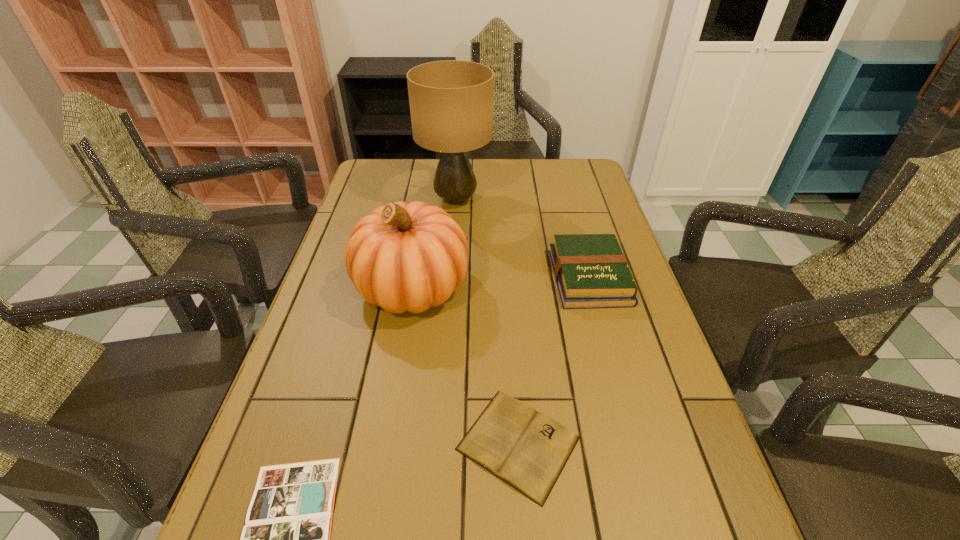
Locate an element on the screen. Image resolution: width=960 pixels, height=540 pixels. vacant area that lies between the tallest object and the second book from right to left is located at coordinates (487, 321).

You are a GUI agent. You are given a task and a screenshot of the screen. Output one action in this format:
    pyautogui.click(x=<x>, y=<y>)
    Task: Click on the vacant point located between the pumpkin and the second book from left to right
    This screenshot has width=960, height=540.
    Given the screenshot: What is the action you would take?
    pyautogui.click(x=466, y=365)

The width and height of the screenshot is (960, 540). What are the coordinates of `vacant space that is in between the fourth shortest object and the tallest book` in the screenshot? It's located at (501, 282).

Locate an element on the screen. This screenshot has height=540, width=960. free space between the rightmost book and the tallest object is located at coordinates (522, 239).

What are the coordinates of `free space between the second tallest object and the fourth tallest object` in the screenshot? It's located at (466, 365).

This screenshot has height=540, width=960. In order to click on free area in between the pumpkin and the third shortest object in this screenshot , I will do `click(501, 282)`.

You are a GUI agent. You are given a task and a screenshot of the screen. Output one action in this format:
    pyautogui.click(x=<x>, y=<y>)
    Task: Click on the object that is the second nearest to the pumpkin
    The height and width of the screenshot is (540, 960).
    Given the screenshot: What is the action you would take?
    pyautogui.click(x=528, y=450)

In order to click on object that can be found as the fourth closest to the farthest object in this screenshot , I will do `click(286, 539)`.

At what (x,y) coordinates should I click in order to perform the action: click on the second closest book to the second tallest object. Please return your answer as a coordinate pair (x, y). The height and width of the screenshot is (540, 960). Looking at the image, I should click on (591, 271).

Identify which book is the nearest to the pumpkin. Please provide its 2D coordinates. Your answer should be formatted as a tuple, i.e. [(x, y)], where the tuple contains the x and y coordinates of a point satisfying the conditions above.

[(528, 450)]